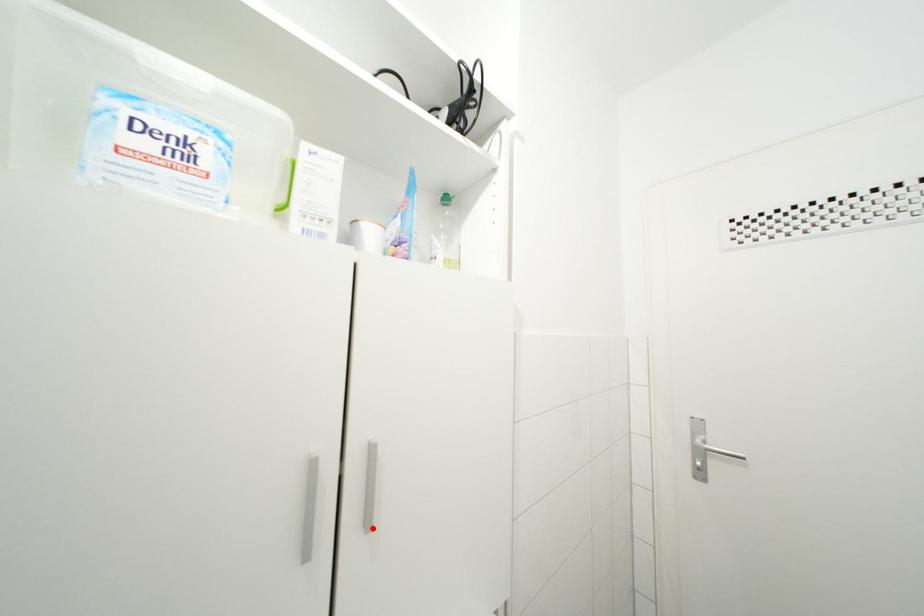
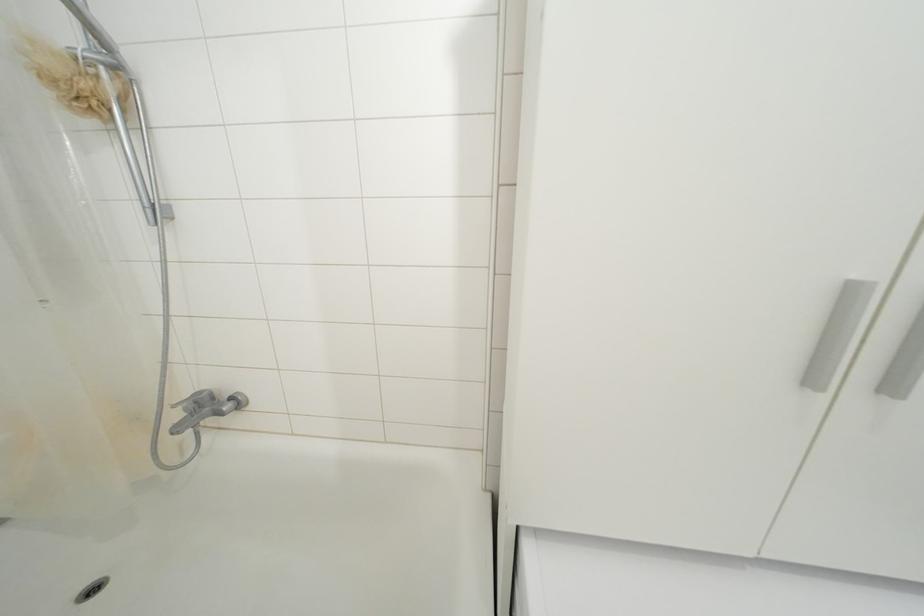
Locate, in the second image, the point that corresponds to the highlighted location in the first image.

(896, 392)